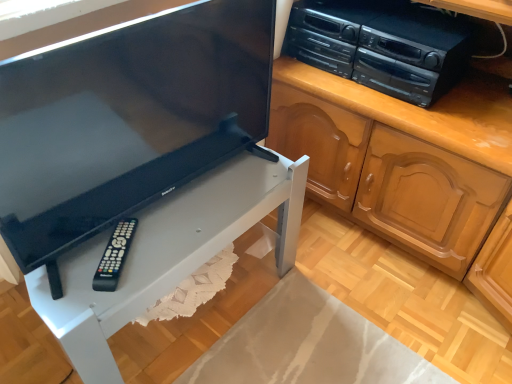
Question: Is black plastic stereo at upper right at the left side of matte black television at center?

Choices:
 (A) no
 (B) yes

Answer: (A)

Question: Does black plastic stereo at upper right turn towards matte black television at center?

Choices:
 (A) no
 (B) yes

Answer: (B)

Question: Is matte black television at center inside black plastic stereo at upper right?

Choices:
 (A) yes
 (B) no

Answer: (B)

Question: Is the depth of black plastic stereo at upper right greater than that of matte black television at center?

Choices:
 (A) no
 (B) yes

Answer: (B)

Question: Is black plastic stereo at upper right facing away from matte black television at center?

Choices:
 (A) no
 (B) yes

Answer: (A)

Question: Is black plastic remote at lower left inside or outside of black plastic stereo at upper right?

Choices:
 (A) outside
 (B) inside

Answer: (A)

Question: Is black plastic remote at lower left bigger or smaller than black plastic stereo at upper right?

Choices:
 (A) small
 (B) big

Answer: (A)

Question: From a real-world perspective, is black plastic remote at lower left physically located above or below black plastic stereo at upper right?

Choices:
 (A) below
 (B) above

Answer: (A)

Question: From the image's perspective, relative to black plastic stereo at upper right, is black plastic remote at lower left above or below?

Choices:
 (A) above
 (B) below

Answer: (B)

Question: Is point (109, 263) positioned closer to the camera than point (71, 284)?

Choices:
 (A) farther
 (B) closer

Answer: (A)

Question: In terms of size, does black plastic remote at lower left appear bigger or smaller than white matte table at lower left?

Choices:
 (A) small
 (B) big

Answer: (A)

Question: From a real-world perspective, is black plastic remote at lower left above or below white matte table at lower left?

Choices:
 (A) above
 (B) below

Answer: (A)

Question: Is black plastic remote at lower left inside or outside of white matte table at lower left?

Choices:
 (A) outside
 (B) inside

Answer: (B)

Question: In the image, is black plastic stereo at upper right positioned in front of or behind matte black television at center?

Choices:
 (A) front
 (B) behind

Answer: (B)

Question: Considering the positions of black plastic stereo at upper right and matte black television at center in the image, is black plastic stereo at upper right bigger or smaller than matte black television at center?

Choices:
 (A) small
 (B) big

Answer: (A)